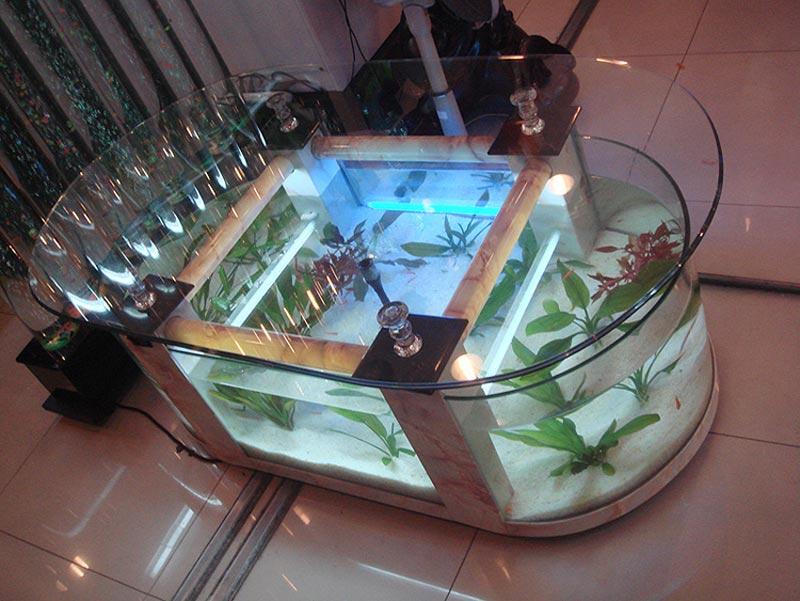
Identify the location of black cord. Image resolution: width=800 pixels, height=601 pixels. (166, 437).